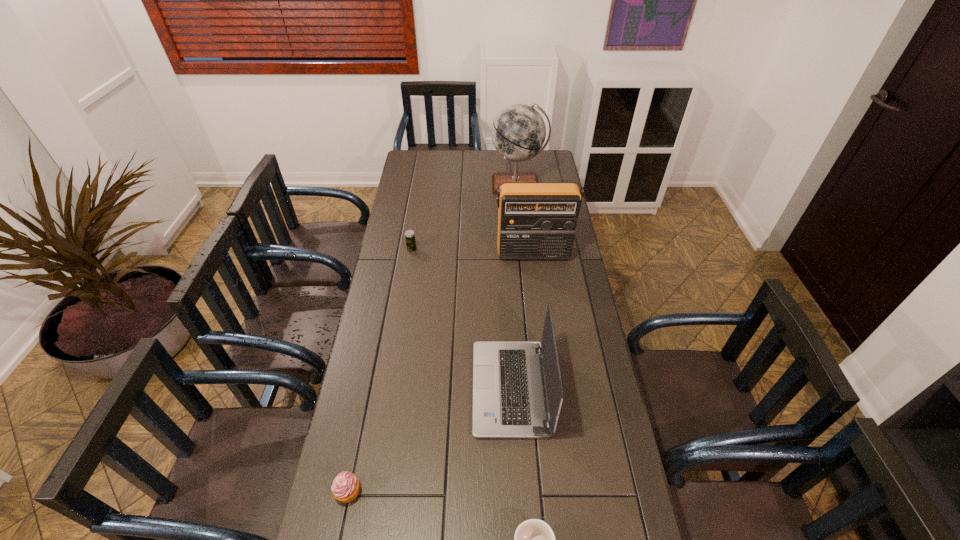
The image size is (960, 540). I want to click on vacant space located 0.260m on the screen of the fourth shortest object, so click(x=389, y=388).

Where is `blank space located 0.100m on the screen of the fourth shortest object`? blank space located 0.100m on the screen of the fourth shortest object is located at coordinates (441, 388).

Image resolution: width=960 pixels, height=540 pixels. I want to click on free spot located 0.370m on the screen of the fourth shortest object, so click(353, 388).

The height and width of the screenshot is (540, 960). Find the location of `vacant space located 0.050m on the back of the beer can`. vacant space located 0.050m on the back of the beer can is located at coordinates (414, 239).

Where is `vacant space located on the right of the leftmost object`? vacant space located on the right of the leftmost object is located at coordinates (507, 491).

Identify the location of object at the far edge. (518, 132).

Where is `beer can located in the left edge section of the desktop`? Image resolution: width=960 pixels, height=540 pixels. beer can located in the left edge section of the desktop is located at coordinates (409, 234).

Identify the location of cupcake that is at the left edge. (345, 488).

This screenshot has height=540, width=960. Identify the location of globe that is at the right edge. (518, 132).

Locate an element on the screen. radio receiver at the right edge is located at coordinates (536, 221).